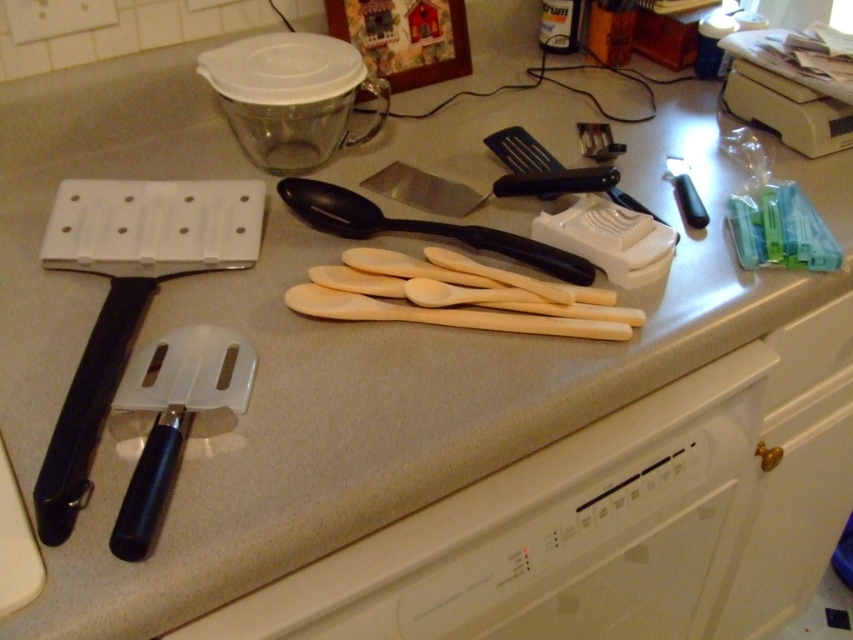
You are organizing the kitchen items on the countertop. You need to place a new item between the black plastic spatula at left and the transparent glass jar at upper center. Where should you position it to ensure it fits between them?

The new item should be placed to the right of the black plastic spatula at left but to the left of the transparent glass jar at upper center since the black plastic spatula at left is positioned to the left of the transparent glass jar at upper center.

You are preparing to bake cookies and need to place the black plastic spatula at left into the white glossy oven at lower center. Based on their sizes, will the spatula fit inside the oven?

The white glossy oven at lower center is larger in size compared to the black plastic spatula at left, so the spatula should fit inside the oven.

You are organizing the kitchen items on the countertop. You need to place a new spice bottle between the transparent glass jar at upper center and the black plastic spoon at center. Where should you place it?

The transparent glass jar at upper center is to the left of the black plastic spoon at center, so you should place the new spice bottle between them, to the right of the transparent glass jar at upper center and to the left of the black plastic spoon at center.